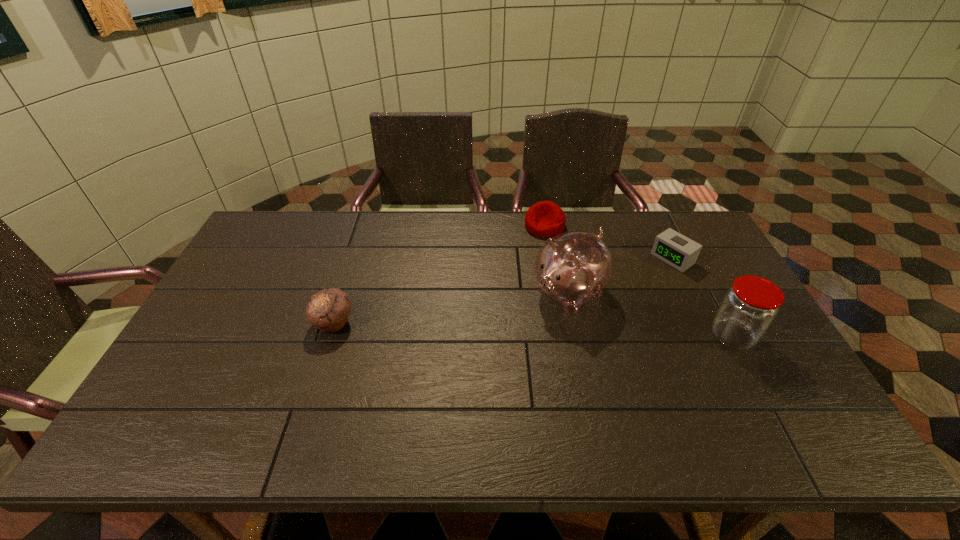
The width and height of the screenshot is (960, 540). In order to click on vacant space on the desktop that is between the third shortest object and the jar and is positioned on the seat area of the beanbag in this screenshot , I will do `click(499, 328)`.

This screenshot has width=960, height=540. In order to click on vacant space on the desktop that is between the third shortest object and the second tallest object and is positioned on the front facing side of the piggy bank in this screenshot , I will do click(513, 329).

Identify the location of free spot on the desktop that is between the muffin and the jar and is positioned on the front-facing side of the alarm clock. This screenshot has width=960, height=540. (568, 331).